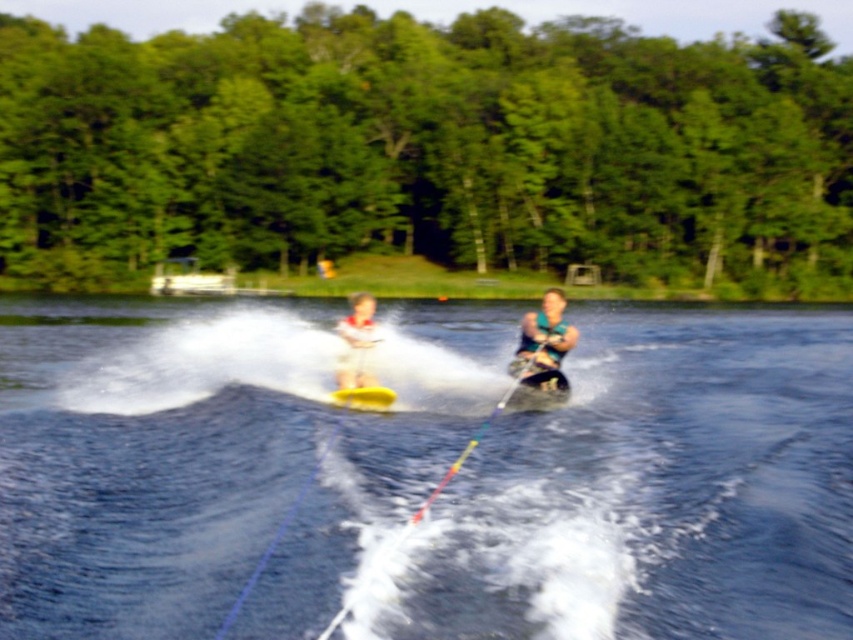
Question: Can you confirm if green leafy trees at upper center is wider than matte green life vest at center?

Choices:
 (A) no
 (B) yes

Answer: (B)

Question: From the image, what is the correct spatial relationship of matte green life vest at center in relation to white matte life vest at center?

Choices:
 (A) below
 (B) above

Answer: (B)

Question: Is white plastic boat at upper center positioned in front of yellow rubber water ski at center?

Choices:
 (A) yes
 (B) no

Answer: (B)

Question: Among these points, which one is farthest from the camera?

Choices:
 (A) coord(167,288)
 (B) coord(224,448)

Answer: (A)

Question: Which point is closer to the camera?

Choices:
 (A) (653, 358)
 (B) (363, 300)
 (C) (543, 320)

Answer: (B)

Question: Which point is farther to the camera?

Choices:
 (A) yellow rubber water ski at center
 (B) white matte life vest at center
 (C) blue water at center
 (D) white plastic boat at upper center

Answer: (D)